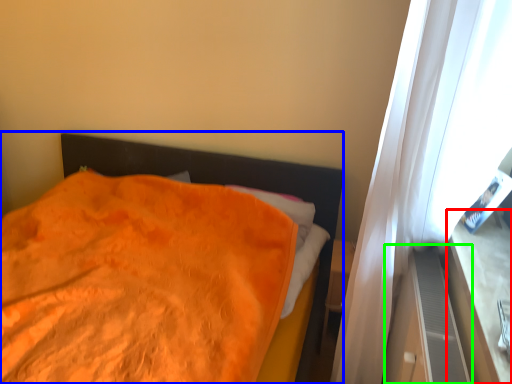
Question: Which is farther away from window sill (highlighted by a red box)? bed (highlighted by a blue box) or dresser (highlighted by a green box)?

Choices:
 (A) bed
 (B) dresser

Answer: (A)